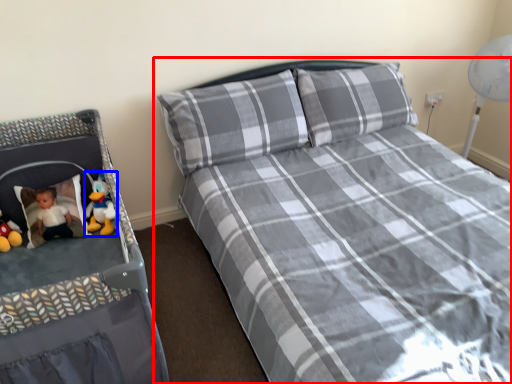
Question: Which object appears closest to the camera in this image, bed (highlighted by a red box) or toy (highlighted by a blue box)?

Choices:
 (A) bed
 (B) toy

Answer: (A)